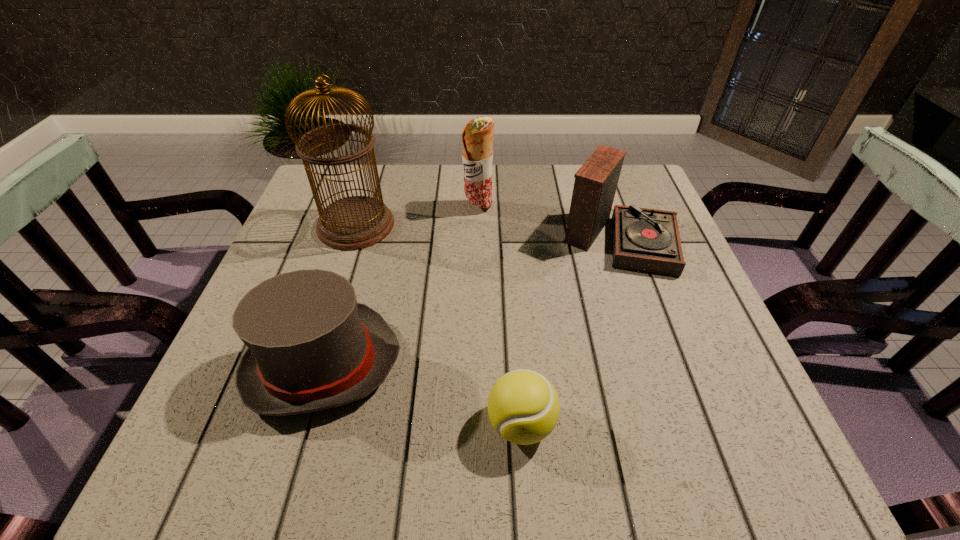
The height and width of the screenshot is (540, 960). What are the coordinates of `vacant area that lies between the burrito and the rightmost object` in the screenshot? It's located at (549, 222).

Find the location of a particular element. The width and height of the screenshot is (960, 540). vacant area that lies between the birdcage and the burrito is located at coordinates (417, 216).

Find the location of `free space between the rightmost object and the tallest object`. free space between the rightmost object and the tallest object is located at coordinates (488, 231).

This screenshot has width=960, height=540. What are the coordinates of `free space between the birdcage and the second tallest object` in the screenshot? It's located at (417, 216).

You are a GUI agent. You are given a task and a screenshot of the screen. Output one action in this format:
    pyautogui.click(x=<x>, y=<y>)
    Task: Click on the unoccupied position between the second shortest object and the rightmost object
    This screenshot has width=960, height=540.
    Given the screenshot: What is the action you would take?
    pyautogui.click(x=470, y=300)

Find the location of a particular element. This screenshot has width=960, height=540. unoccupied position between the tennis ball and the phonograph record is located at coordinates (570, 330).

Identify the location of object that stands as the second closest to the birdcage. The width and height of the screenshot is (960, 540). (311, 346).

Image resolution: width=960 pixels, height=540 pixels. I want to click on object that is the third closest to the tennis ball, so click(356, 222).

Identify the location of free space that satisfies the following two spatial constraints: 1. on the front-facing side of the phonograph record; 2. on the right side of the birdcage. Image resolution: width=960 pixels, height=540 pixels. (352, 237).

At what (x,y) coordinates should I click in order to perform the action: click on vacant area that satisfies the following two spatial constraints: 1. on the front-facing side of the birdcage; 2. on the back side of the fourth tallest object. Please return your answer as a coordinate pair (x, y). This screenshot has width=960, height=540. Looking at the image, I should click on (312, 364).